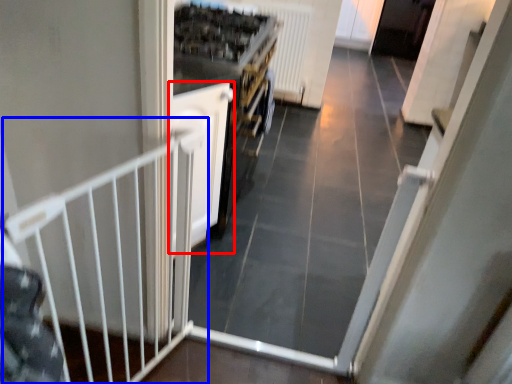
Question: Which object appears farthest to the camera in this image, door (highlighted by a red box) or rail (highlighted by a blue box)?

Choices:
 (A) door
 (B) rail

Answer: (A)